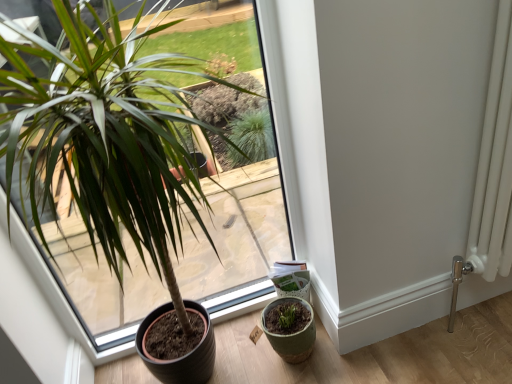
Where is `free space in front of green matte flowerpot at lower right`? The image size is (512, 384). free space in front of green matte flowerpot at lower right is located at coordinates (308, 373).